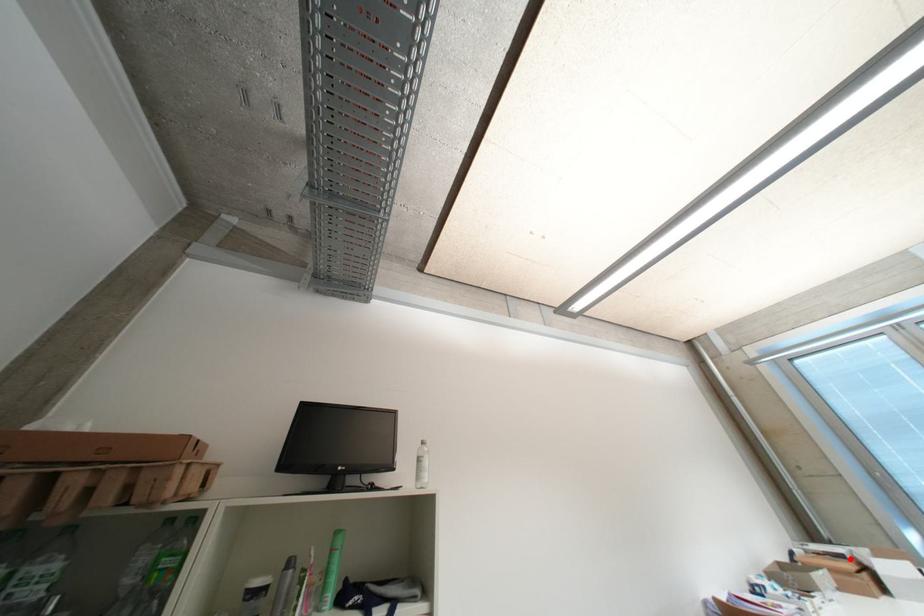
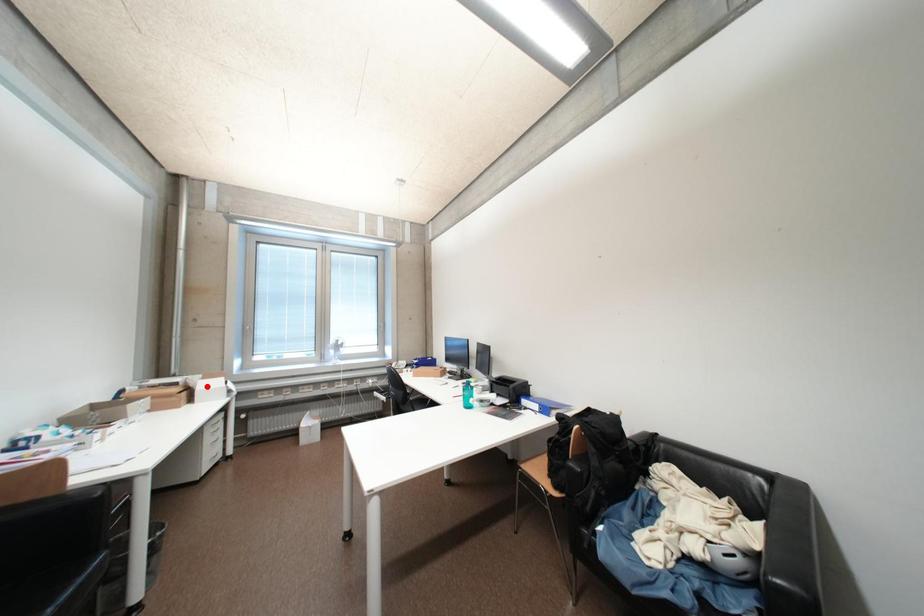
I am providing you with two images of the same scene from different viewpoints. A red point is marked on the first image and another point is marked on the second image. Is the marked point in image1 the same physical position as the marked point in image2?

No